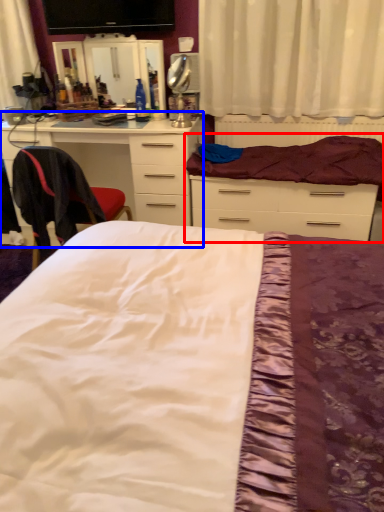
Question: Which object is closer to the camera taking this photo, bed (highlighted by a red box) or chest of drawers (highlighted by a blue box)?

Choices:
 (A) bed
 (B) chest of drawers

Answer: (A)